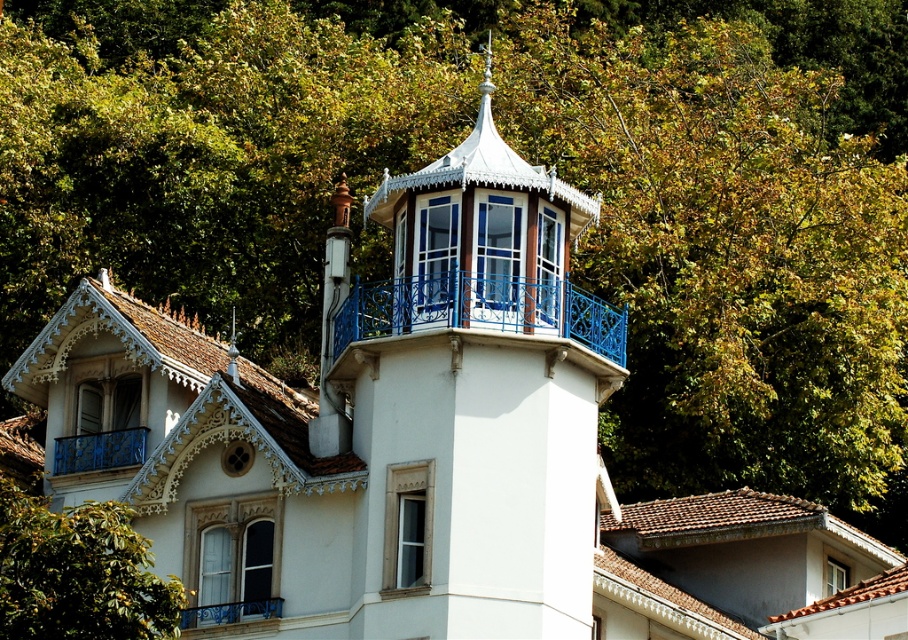
How distant is green leafy tree at center from blue painted metal balcony at lower center?

green leafy tree at center is 11.08 meters away from blue painted metal balcony at lower center.

Does green leafy tree at center have a greater height compared to blue painted metal balcony at lower center?

Indeed, green leafy tree at center has a greater height compared to blue painted metal balcony at lower center.

Image resolution: width=908 pixels, height=640 pixels. What do you see at coordinates (77, 572) in the screenshot?
I see `green leafy tree at center` at bounding box center [77, 572].

Locate an element on the screen. Image resolution: width=908 pixels, height=640 pixels. green leafy tree at center is located at coordinates (77, 572).

This screenshot has height=640, width=908. What do you see at coordinates (99, 451) in the screenshot? I see `blue painted metal railing at lower left` at bounding box center [99, 451].

Does blue painted metal railing at lower left have a smaller size compared to blue painted metal balcony at lower center?

Actually, blue painted metal railing at lower left might be larger than blue painted metal balcony at lower center.

Between point (142, 444) and point (211, 625), which one is positioned in front?

Point (211, 625) is in front.

The height and width of the screenshot is (640, 908). I want to click on blue painted metal railing at lower left, so click(x=99, y=451).

Is white painted wood bell tower at center to the right of green leafy tree at center from the viewer's perspective?

Yes, white painted wood bell tower at center is to the right of green leafy tree at center.

Can you confirm if white painted wood bell tower at center is wider than green leafy tree at center?

Yes.

Between point (496, 552) and point (121, 588), which one is positioned behind?

The point (496, 552) is more distant.

Identify the location of white painted wood bell tower at center. The image size is (908, 640). (469, 401).